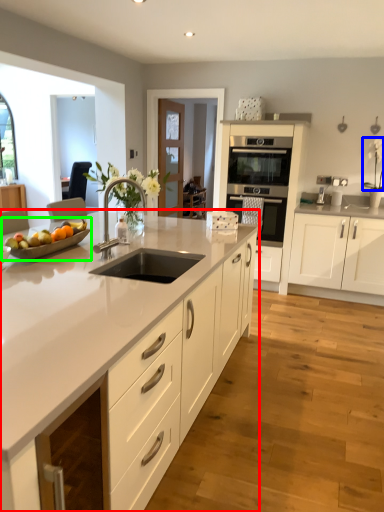
Question: Which is farther away from cabinetry (highlighted by a red box)? flower (highlighted by a blue box) or fruit dish (highlighted by a green box)?

Choices:
 (A) flower
 (B) fruit dish

Answer: (A)